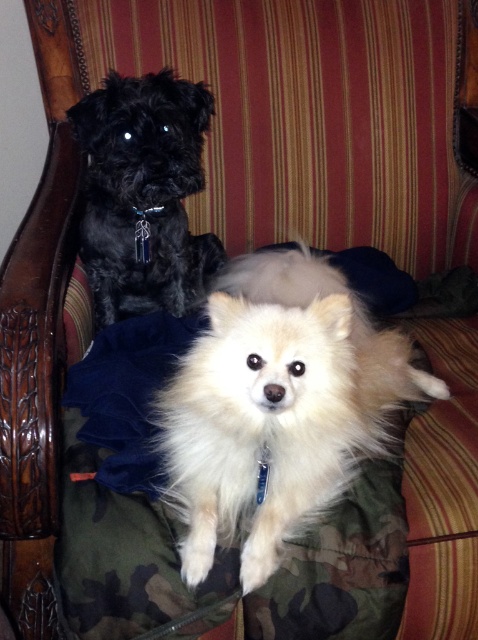
From the picture: Can you confirm if white fluffy dog at center is positioned to the right of shiny black fur at upper left?

Indeed, white fluffy dog at center is positioned on the right side of shiny black fur at upper left.

Is white fluffy dog at center taller than shiny black fur at upper left?

Yes.

The image size is (478, 640). Find the location of `white fluffy dog at center`. white fluffy dog at center is located at coordinates (276, 406).